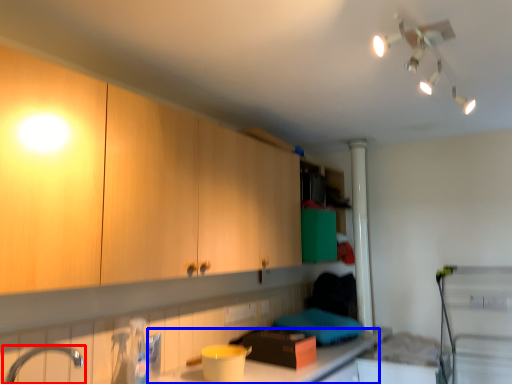
Question: Among these objects, which one is farthest to the camera, tap (highlighted by a red box) or countertop (highlighted by a blue box)?

Choices:
 (A) tap
 (B) countertop

Answer: (B)